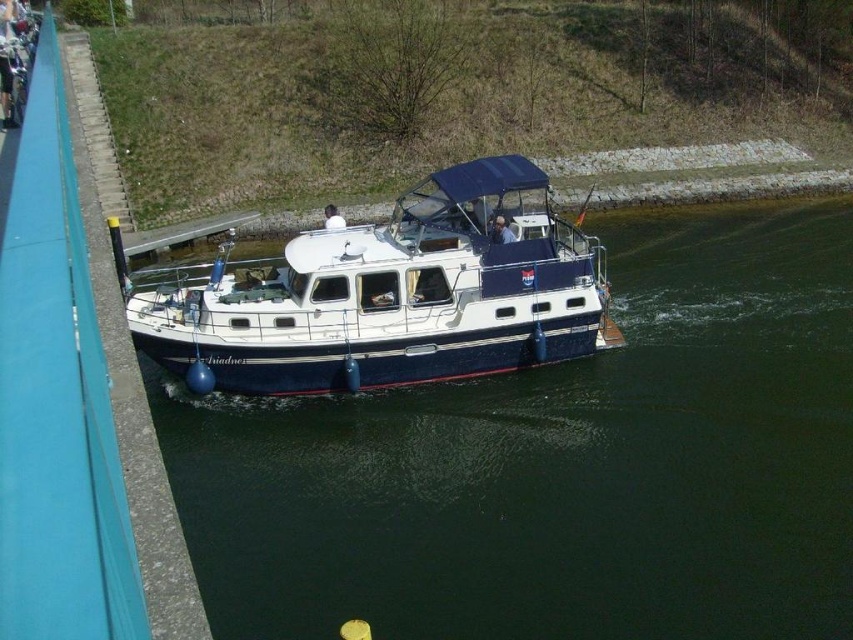
Question: Can you confirm if dark blue water at center is smaller than blue polished wood boat at center?

Choices:
 (A) yes
 (B) no

Answer: (B)

Question: Which of the following is the closest to the observer?

Choices:
 (A) (335, 218)
 (B) (405, 298)
 (C) (496, 230)
 (D) (782, 378)

Answer: (B)

Question: Is dark blue water at center to the right of matte white shirt at center from the viewer's perspective?

Choices:
 (A) no
 (B) yes

Answer: (B)

Question: Does dark blue water at center appear on the right side of matte white shirt at center?

Choices:
 (A) yes
 (B) no

Answer: (A)

Question: Which object is closer to the camera taking this photo?

Choices:
 (A) dark blue water at center
 (B) white fabric person at center

Answer: (A)

Question: Among these objects, which one is nearest to the camera?

Choices:
 (A) white fabric person at center
 (B) blue polished wood boat at center

Answer: (B)